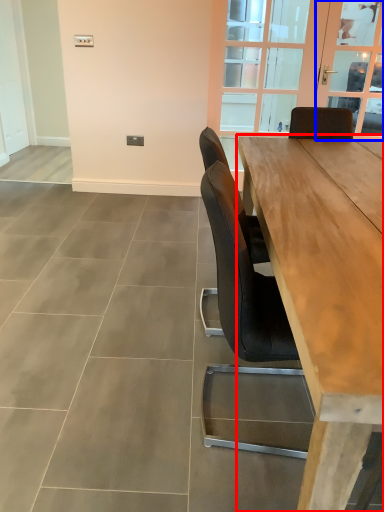
Question: Which point is further to the camera, table (highlighted by a red box) or window screen (highlighted by a blue box)?

Choices:
 (A) table
 (B) window screen

Answer: (B)